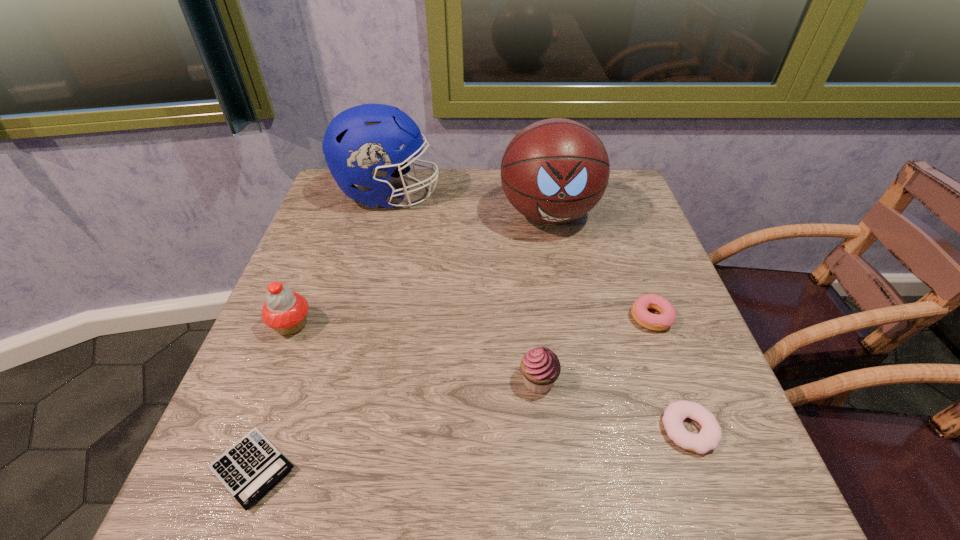
Locate an element on the screen. This screenshot has width=960, height=540. free space between the taller cupcake and the second shortest object is located at coordinates (491, 377).

This screenshot has height=540, width=960. In order to click on free area in between the football helmet and the basketball in this screenshot , I will do `click(468, 204)`.

This screenshot has width=960, height=540. In order to click on vacant area between the third tallest object and the calculator in this screenshot , I will do point(272,396).

Locate an element on the screen. free space between the farther cupcake and the nearer doughnut is located at coordinates pos(491,377).

You are a GUI agent. You are given a task and a screenshot of the screen. Output one action in this format:
    pyautogui.click(x=<x>, y=<y>)
    Task: Click on the empty space between the nearer doughnut and the football helmet
    This screenshot has height=540, width=960.
    Given the screenshot: What is the action you would take?
    pyautogui.click(x=539, y=312)

Choose which object is the sixth nearest neighbor to the right cupcake. Please provide its 2D coordinates. Your answer should be formatted as a tuple, i.e. [(x, y)], where the tuple contains the x and y coordinates of a point satisfying the conditions above.

[(361, 145)]

Identify which object is the fifth nearest to the shorter doughnut. Please provide its 2D coordinates. Your answer should be formatted as a tuple, i.e. [(x, y)], where the tuple contains the x and y coordinates of a point satisfying the conditions above.

[(285, 311)]

Locate an element on the screen. The image size is (960, 540). blank space that satisfies the following two spatial constraints: 1. on the front-facing side of the football helmet; 2. on the left side of the third shortest object is located at coordinates (355, 317).

In order to click on free space that satisfies the following two spatial constraints: 1. on the back side of the basketball; 2. on the left side of the farther cupcake in this screenshot , I will do `click(335, 214)`.

Image resolution: width=960 pixels, height=540 pixels. What are the coordinates of `vacant area in the image that satisfies the following two spatial constraints: 1. on the back side of the farther cupcake; 2. on the right side of the basketball` in the screenshot? It's located at (335, 214).